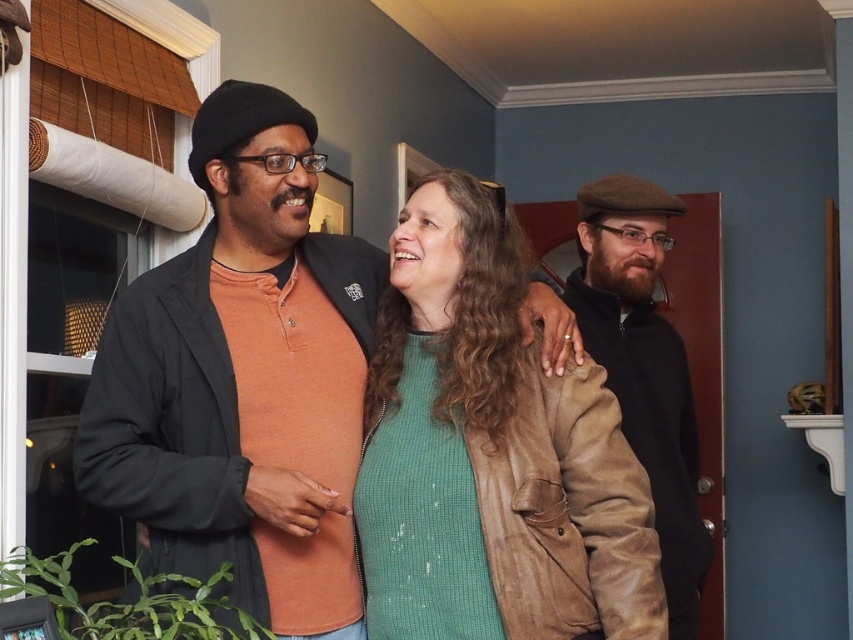
Question: Which is farther from the green textured sweater at center?

Choices:
 (A) brown leather jacket at center
 (B) brown suede cap at right

Answer: (B)

Question: Can you confirm if green textured sweater at center is bigger than brown suede cap at right?

Choices:
 (A) no
 (B) yes

Answer: (A)

Question: Which point is closer to the camera taking this photo?

Choices:
 (A) (685, 401)
 (B) (312, 129)
 (C) (397, 429)

Answer: (C)

Question: Is brown leather jacket at center smaller than green textured sweater at center?

Choices:
 (A) yes
 (B) no

Answer: (B)

Question: Which point is farther to the camera?

Choices:
 (A) [195, 577]
 (B) [595, 188]
 (C) [433, 467]

Answer: (B)

Question: Does brown leather jacket at center appear on the right side of green textured sweater at center?

Choices:
 (A) yes
 (B) no

Answer: (B)